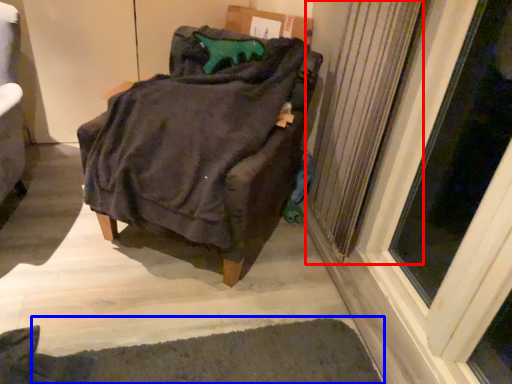
Question: Among these objects, which one is nearest to the camera, radiator (highlighted by a red box) or doormat (highlighted by a blue box)?

Choices:
 (A) radiator
 (B) doormat

Answer: (B)